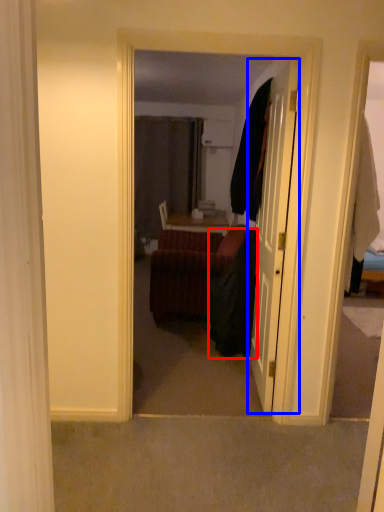
Question: Which point is further to the camera, robe (highlighted by a red box) or door (highlighted by a blue box)?

Choices:
 (A) robe
 (B) door

Answer: (A)